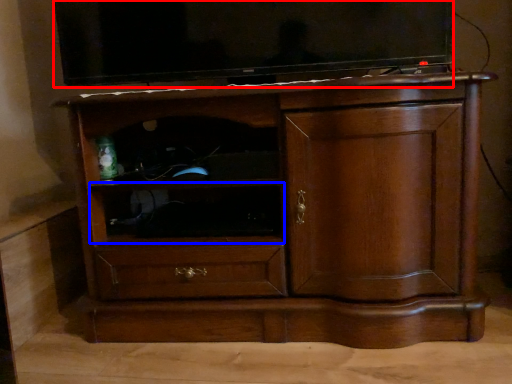
Question: Among these objects, which one is farthest to the camera, television (highlighted by a red box) or shelf (highlighted by a blue box)?

Choices:
 (A) television
 (B) shelf

Answer: (B)